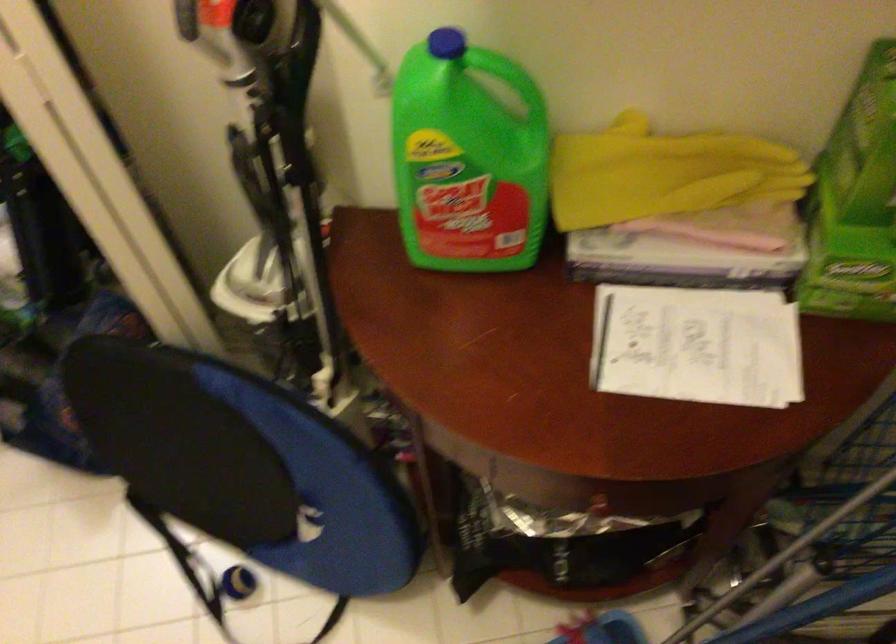
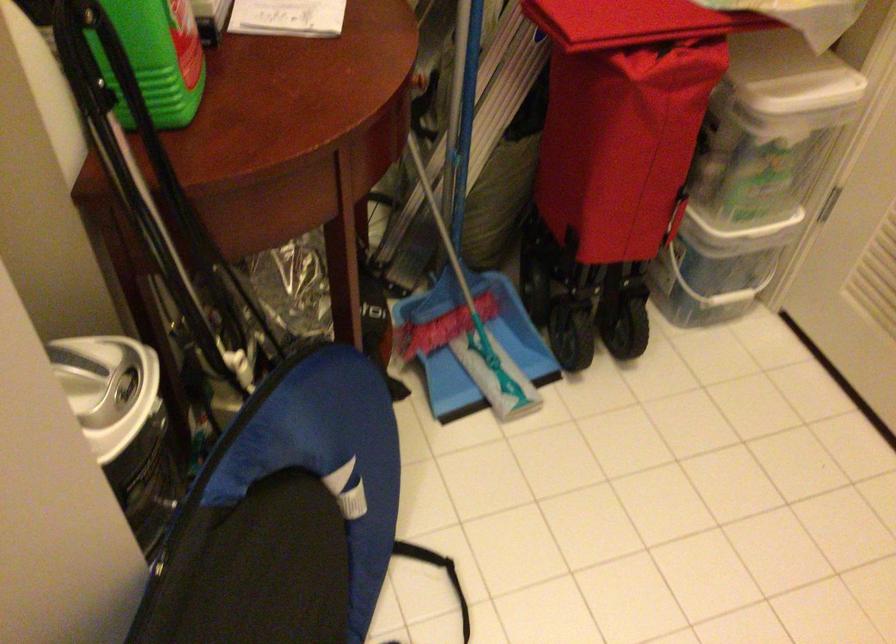
Locate, in the second image, the point that corresponds to point (406, 209) in the first image.

(156, 59)